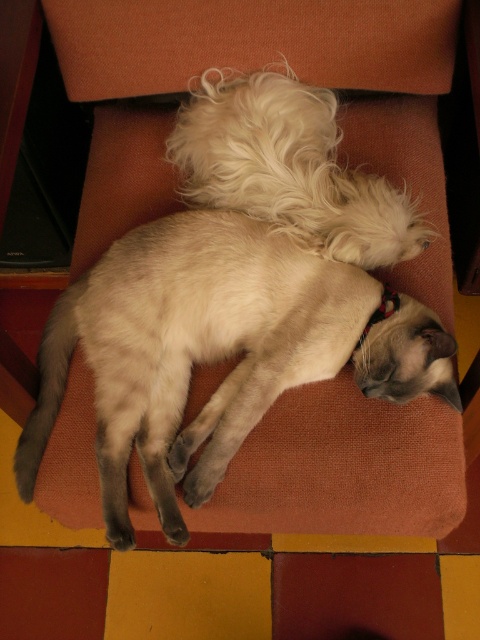
You are a photographer setting up a camera at the origin point. The camera can only capture objects within a 0.5 radius. Is the silky white cat at center within the camera frame?

The silky white cat at center is located at point [215,352], which is within the 0.5 radius from the origin point, so it is within the camera frame.

You are a photographer trying to capture a clear shot of both the silky white cat at center and the white fluffy dog at upper center. Which subject should you focus on first to ensure both are in focus?

You should focus on the silky white cat at center first since it is closer to the viewer than the white fluffy dog at upper center. By focusing on the closer subject, the farther one may still be within the depth of field, ensuring both are in focus.

From the picture: You are a photographer setting up a shoot in this room. You need to position a camera to capture both the silky white cat at center and the white fluffy dog at upper center in the same frame. Based on their positions, which animal should be placed on the left side of the frame?

The silky white cat at center should be placed on the left side of the frame because it is positioned to the left of the white fluffy dog at upper center.